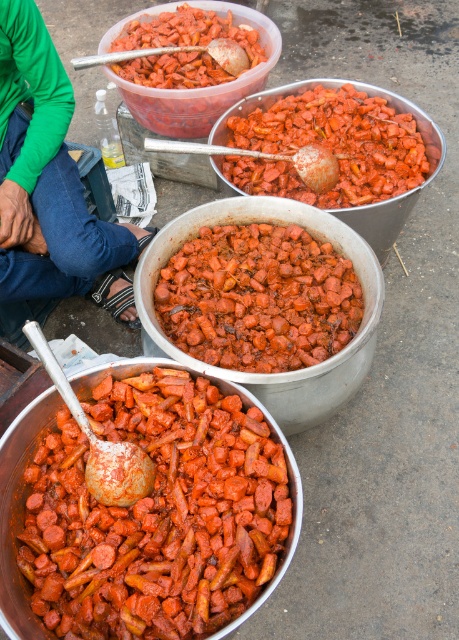
You are a food vendor at an outdoor event. You have two types of carrots displayed in your containers. One is a glossy red carrot at center and the other is matte plastic carrots at center. A customer asks which carrot is real. Based on their appearance and the context of the scene, which one is likely the real carrot?

The glossy red carrot at center is likely the real carrot because real carrots often have a shiny, glossy appearance when fresh, while the matte plastic carrots at center probably serve as decorative or non edible placeholders given their matte texture.

You are a food inspector standing at the bottom of the image. You need to locate the shiny red carrot at bottom left. What are its coordinates?

The coordinates of the shiny red carrot at bottom left are at point (156, 513).